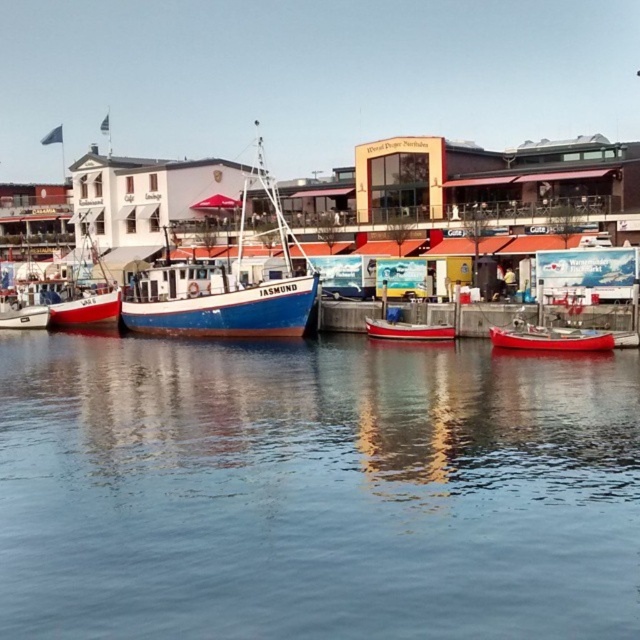
Can you confirm if transparent water at center is shorter than red matte boat at center?

Incorrect, transparent water at center's height does not fall short of red matte boat at center's.

Is transparent water at center bigger than red matte boat at center?

Correct, transparent water at center is larger in size than red matte boat at center.

Find the location of a particular element. The height and width of the screenshot is (640, 640). transparent water at center is located at coordinates (314, 490).

Image resolution: width=640 pixels, height=640 pixels. I want to click on transparent water at center, so click(314, 490).

Does blue matte boat at center have a larger size compared to red matte canoe at lower right?

Correct, blue matte boat at center is larger in size than red matte canoe at lower right.

Is blue matte boat at center thinner than red matte canoe at lower right?

Incorrect, blue matte boat at center's width is not less than red matte canoe at lower right's.

Who is more distant from viewer, (304, 310) or (502, 337)?

Point (304, 310)

Locate an element on the screen. Image resolution: width=640 pixels, height=640 pixels. blue matte boat at center is located at coordinates (221, 291).

Which is behind, point (292, 316) or point (420, 330)?

The point (292, 316) is behind.

Between blue matte boat at center and red matte boat at center, which one appears on the left side from the viewer's perspective?

blue matte boat at center is more to the left.

Who is more distant from viewer, (291,308) or (380,321)?

Point (291,308)

Where is `blue matte boat at center`? This screenshot has height=640, width=640. blue matte boat at center is located at coordinates (221, 291).